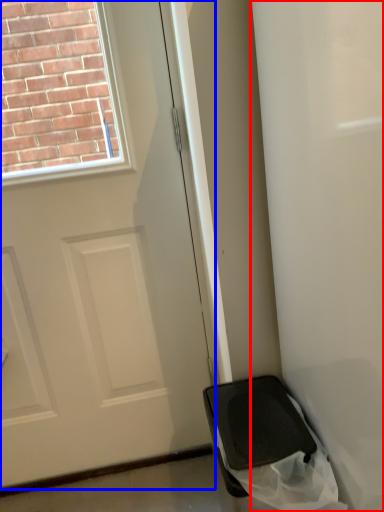
Question: Which point is further to the camera, screen door (highlighted by a red box) or door (highlighted by a blue box)?

Choices:
 (A) screen door
 (B) door

Answer: (B)